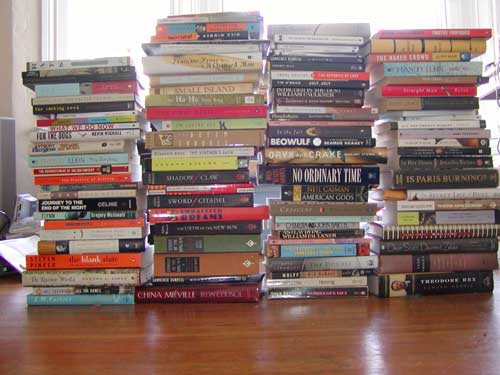
At what (x,y) coordinates should I click in order to perform the action: click on window. Please return your answer as a coordinate pair (x, y). The height and width of the screenshot is (375, 500). Looking at the image, I should click on (400, 22).